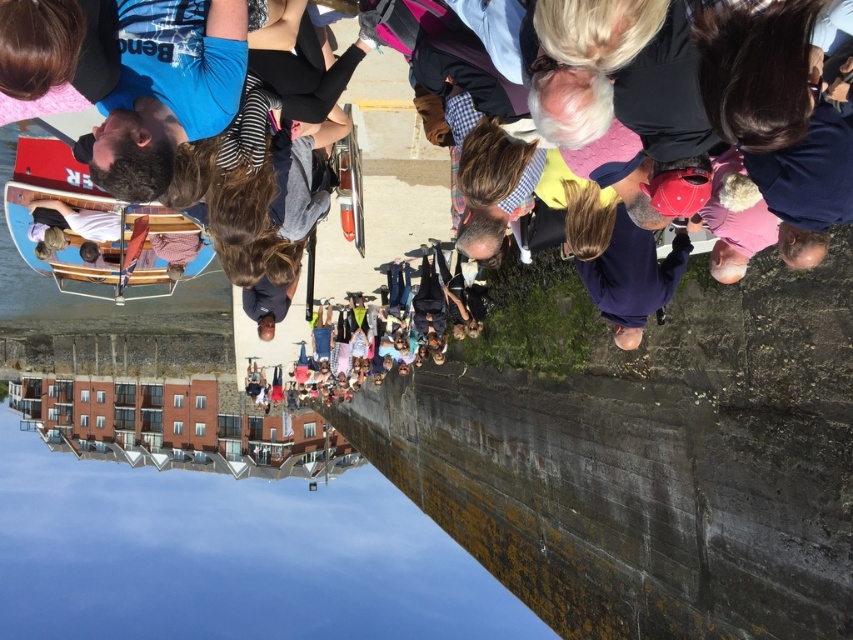
Question: Is red wood boat at left positioned at the back of wooden boat at center?

Choices:
 (A) no
 (B) yes

Answer: (A)

Question: Which of the following is the farthest from the observer?

Choices:
 (A) (347, 365)
 (B) (175, 266)
 (C) (19, 179)
 (D) (183, 620)

Answer: (D)

Question: Is smooth concrete waterway at lower left positioned at the back of multicolored casual clothing at center?

Choices:
 (A) no
 (B) yes

Answer: (B)

Question: Estimate the real-world distances between objects in this image. Which object is closer to the multicolored casual clothing at center?

Choices:
 (A) red wood boat at left
 (B) smooth concrete waterway at lower left

Answer: (A)

Question: From the image, what is the correct spatial relationship of red wood boat at left in relation to wooden boat at center?

Choices:
 (A) left
 (B) right

Answer: (A)

Question: Which of these objects is positioned closest to the smooth concrete waterway at lower left?

Choices:
 (A) red wood boat at left
 (B) wooden boat at center

Answer: (A)